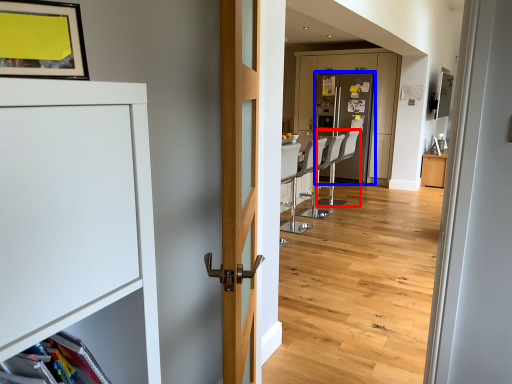
Question: Among these objects, which one is nearest to the camera, armchair (highlighted by a red box) or screen door (highlighted by a blue box)?

Choices:
 (A) armchair
 (B) screen door

Answer: (A)